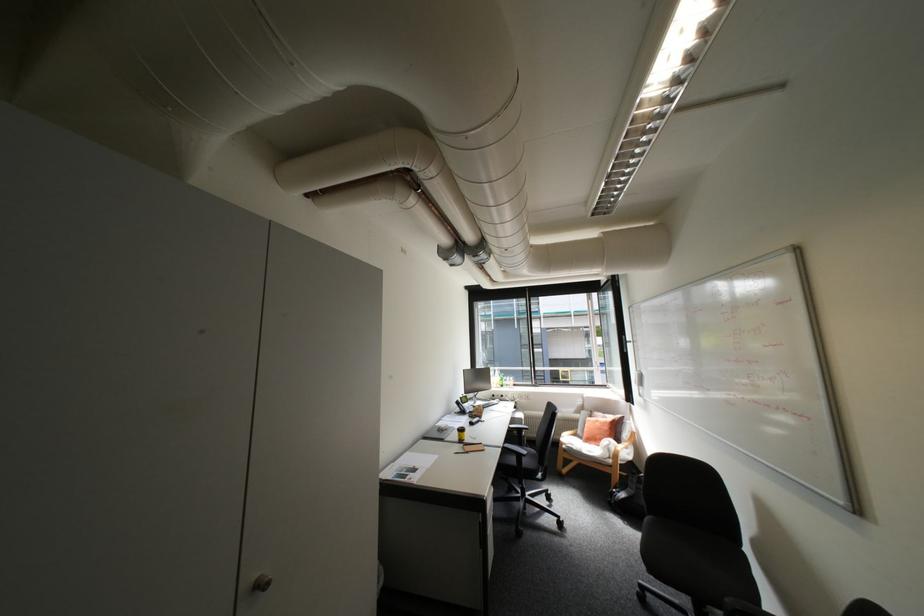
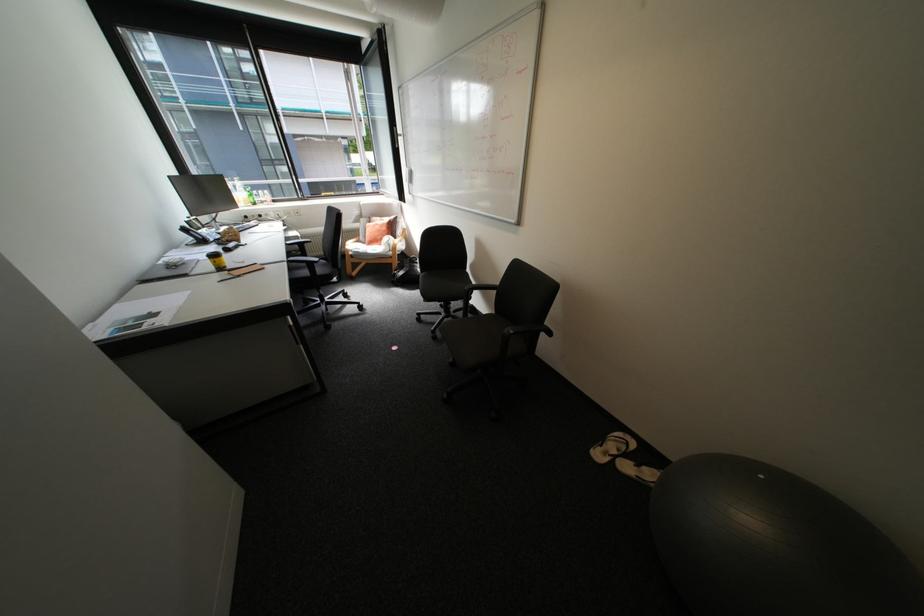
Locate, in the second image, the point that corresponds to [512,446] in the first image.

(295, 259)